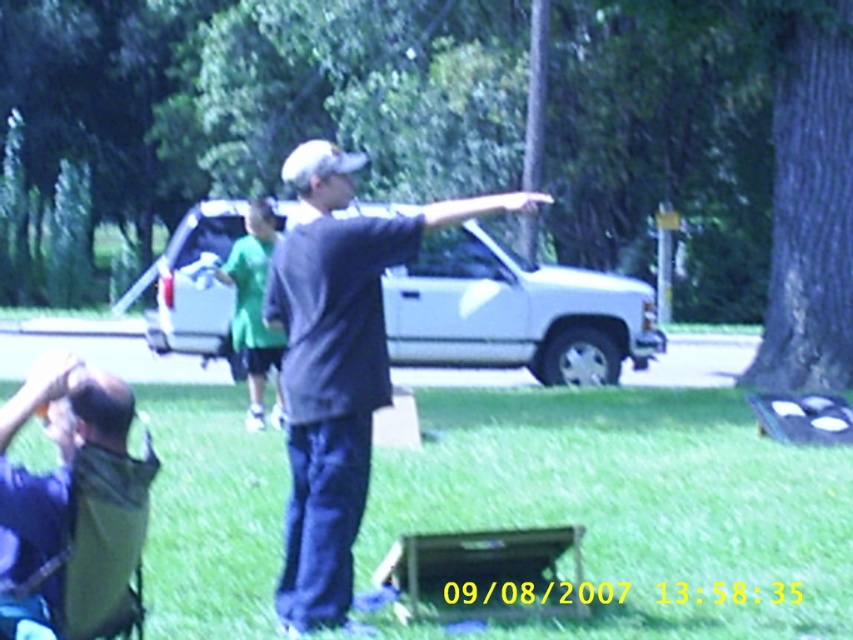
You are planning to set up a picnic area in the park. You have a green fabric folding chair at lower left and a brown textured tree at center right. Which object takes up more horizontal space in the image?

The brown textured tree at center right takes up more horizontal space in the image because its width is larger than the green fabric folding chair at lower left.

You are standing at the camera position and want to walk directly to the brown textured tree at center right. How many steps would you need to take if each step covers about 3 feet?

The distance between the brown textured tree at center right and the camera is 45.61 feet. Since each step covers approximately 3 feet, dividing 45.61 by 3 gives roughly 15.2 steps. Therefore, you would need to take around 15 to 16 steps to reach the brown textured tree at center right.

You are standing at point A located at coordinates (476, 131) in the image. What object is directly in front of you at that point?

The brown textured tree at center right is located at point (476, 131), so the object directly in front of you at that point is the brown textured tree at center right.